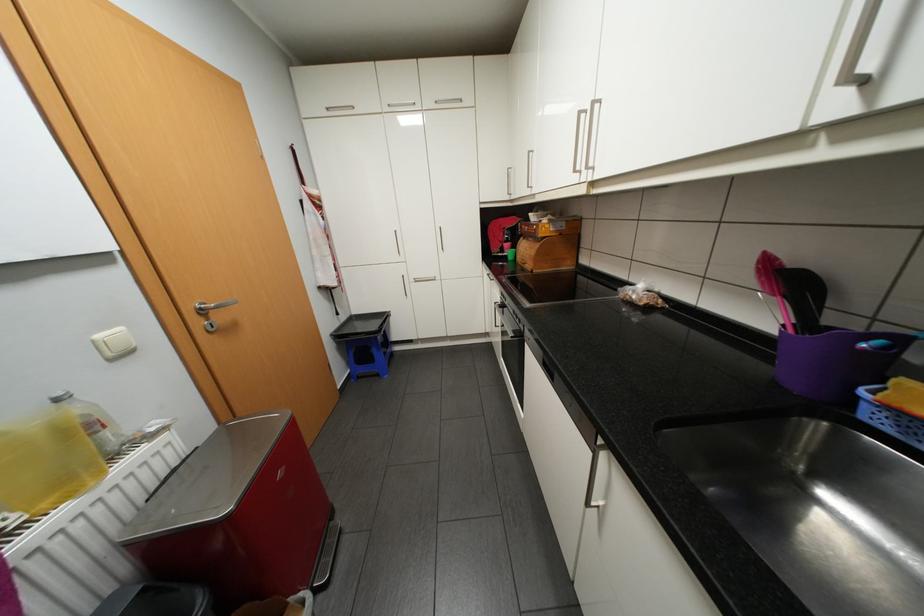
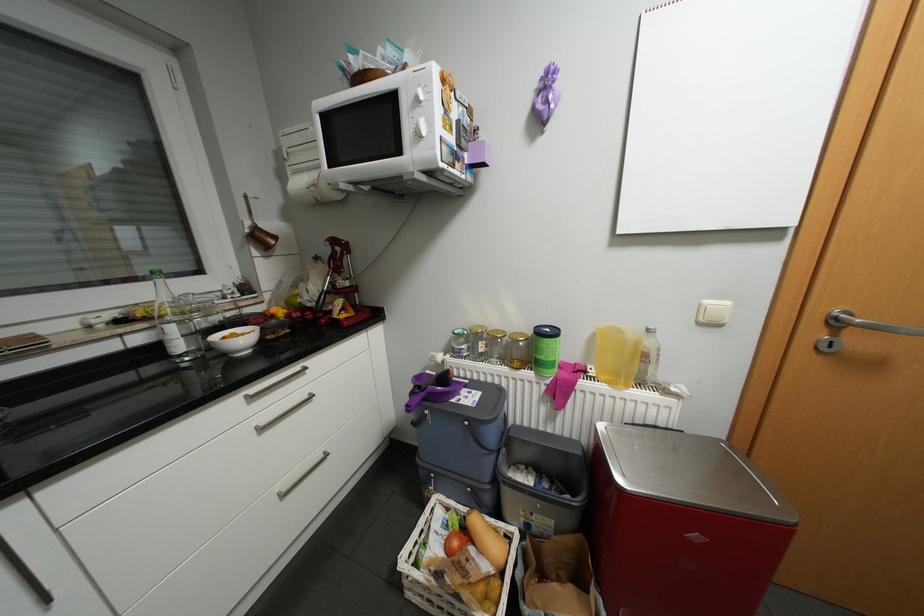
The point at (119, 359) is marked in the first image. Where is the corresponding point in the second image?

(708, 323)